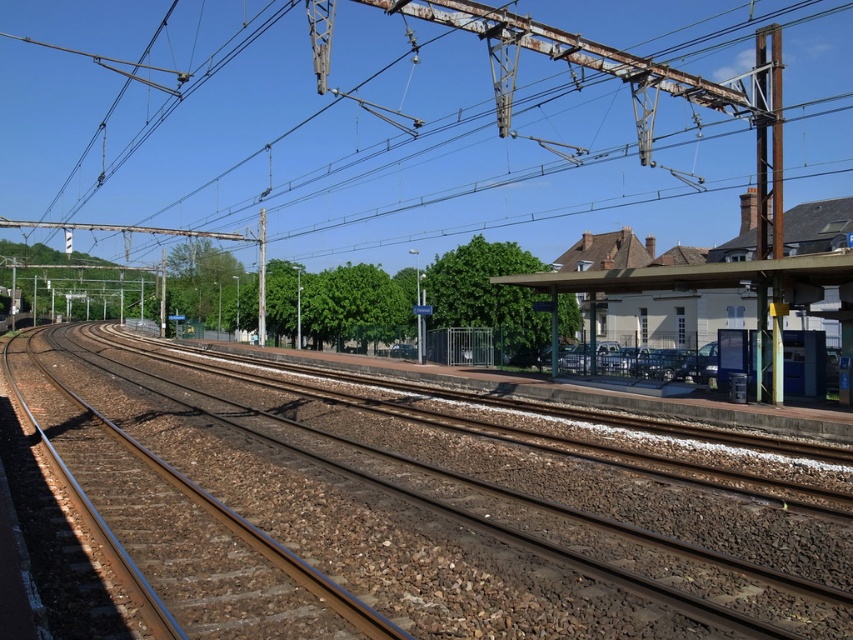
Locate an element on the screen. This screenshot has height=640, width=853. rusty metal power lines at upper center is located at coordinates (361, 147).

In the scene shown: Who is shorter, brown gravel train track at center or white painted platform at right?

Standing shorter between the two is brown gravel train track at center.

The width and height of the screenshot is (853, 640). What do you see at coordinates (403, 518) in the screenshot? I see `brown gravel train track at center` at bounding box center [403, 518].

You are a GUI agent. You are given a task and a screenshot of the screen. Output one action in this format:
    pyautogui.click(x=<x>, y=<y>)
    Task: Click on the brown gravel train track at center
    
    Given the screenshot: What is the action you would take?
    pyautogui.click(x=403, y=518)

Can you confirm if rusty metal power lines at upper center is bigger than white painted platform at right?

Correct, rusty metal power lines at upper center is larger in size than white painted platform at right.

Who is more distant from viewer, (10, 141) or (701, 282)?

The point (10, 141) is more distant.

Image resolution: width=853 pixels, height=640 pixels. What are the coordinates of `rusty metal power lines at upper center` in the screenshot? It's located at (361, 147).